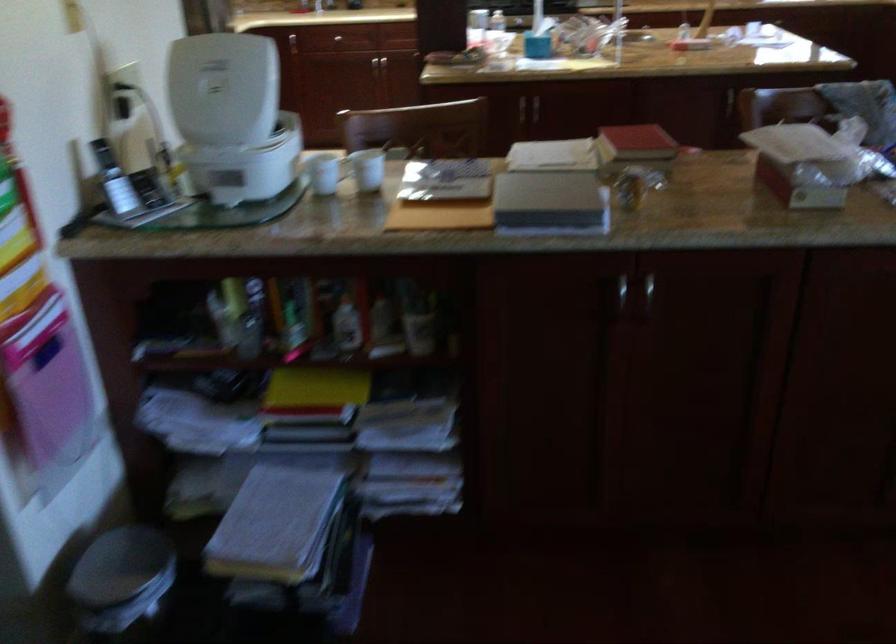
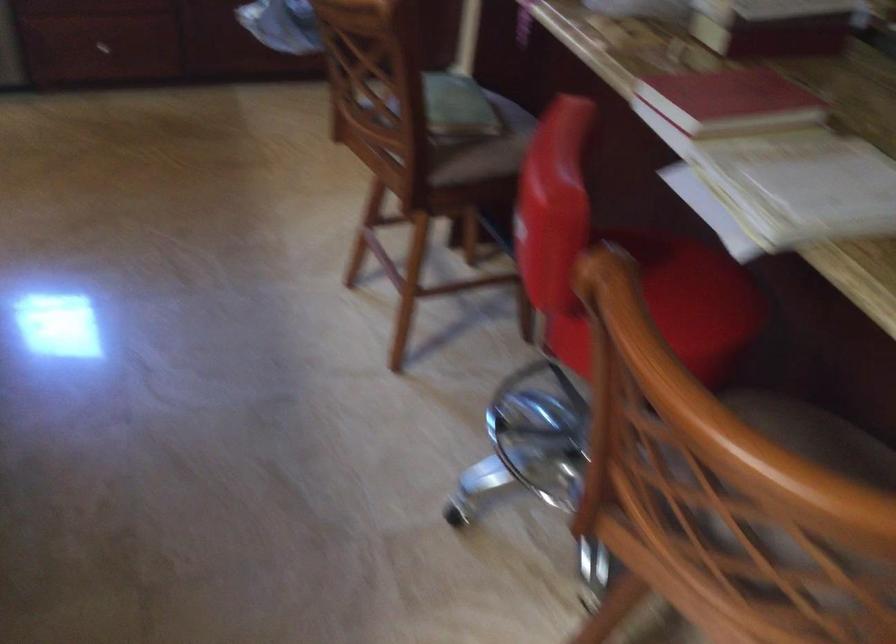
Locate, in the second image, the point that corresponds to (621,136) in the first image.

(729, 100)